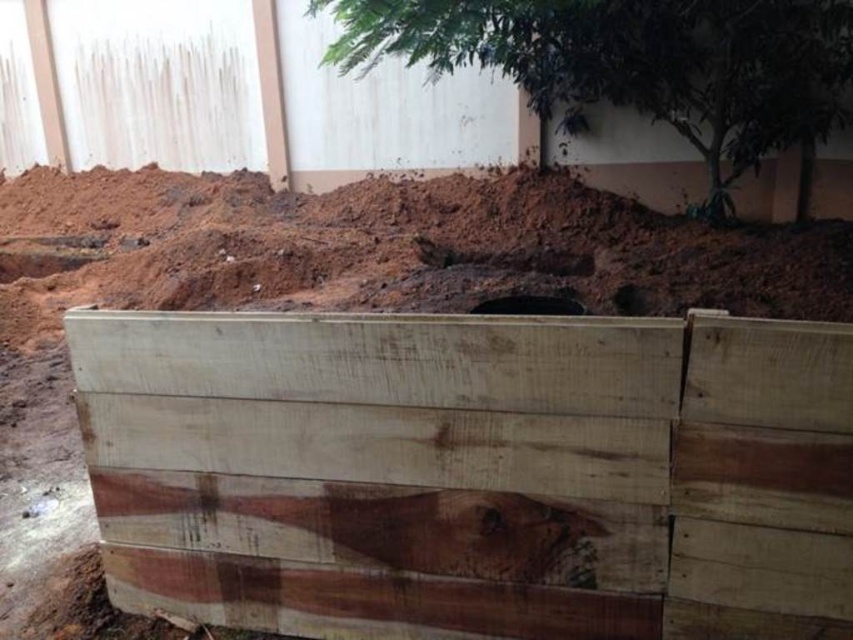
Is point (190, 576) positioned in front of point (409, 54)?

Yes, it is in front of point (409, 54).

Is weathered wood crate at center closer to camera compared to green leafy tree at upper center?

Yes.

Image resolution: width=853 pixels, height=640 pixels. In order to click on weathered wood crate at center in this screenshot , I will do `click(473, 472)`.

Identify the location of weathered wood crate at center. Image resolution: width=853 pixels, height=640 pixels. (473, 472).